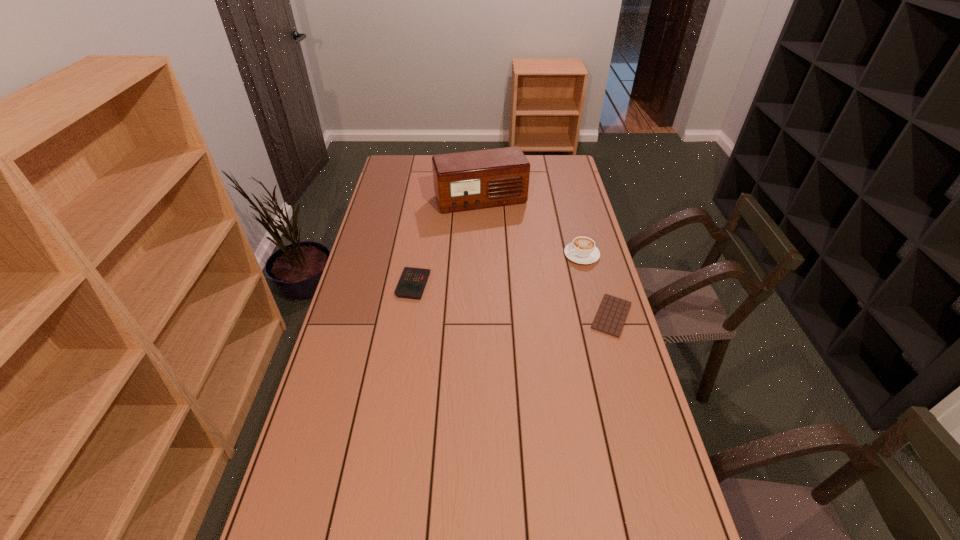
The width and height of the screenshot is (960, 540). What are the coordinates of `vacant area that lies between the second tallest object and the calculator` in the screenshot? It's located at (497, 269).

Locate an element on the screen. vacant space in between the calculator and the second farthest object is located at coordinates (497, 269).

The width and height of the screenshot is (960, 540). I want to click on empty space that is in between the radio receiver and the cappuccino, so click(531, 227).

Image resolution: width=960 pixels, height=540 pixels. In order to click on empty space between the farthest object and the calculator in this screenshot , I will do `click(446, 242)`.

Locate an element on the screen. object that can be found as the second closest to the shortest object is located at coordinates (463, 181).

Locate which object ranks second in proximity to the third shortest object. Please provide its 2D coordinates. Your answer should be formatted as a tuple, i.e. [(x, y)], where the tuple contains the x and y coordinates of a point satisfying the conditions above.

[(463, 181)]

You are a GUI agent. You are given a task and a screenshot of the screen. Output one action in this format:
    pyautogui.click(x=<x>, y=<y>)
    Task: Click on the vacant space that satisfies the following two spatial constraints: 1. on the front side of the cappuccino; 2. on the right side of the tallest object
    
    Given the screenshot: What is the action you would take?
    pyautogui.click(x=481, y=255)

At what (x,y) coordinates should I click in order to perform the action: click on free location that satisfies the following two spatial constraints: 1. on the front side of the chocolate bar; 2. on the right side of the third tallest object. Please return your answer as a coordinate pair (x, y). Looking at the image, I should click on (408, 316).